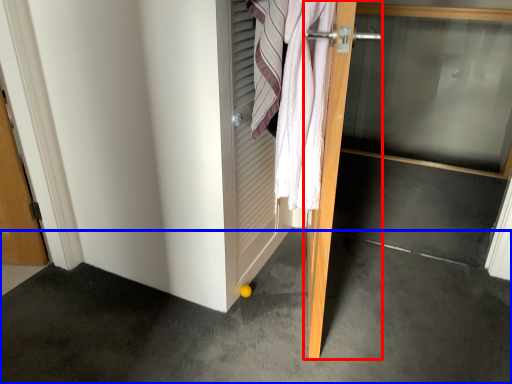
Question: Among these objects, which one is nearest to the camera, door (highlighted by a red box) or concrete (highlighted by a blue box)?

Choices:
 (A) door
 (B) concrete

Answer: (B)